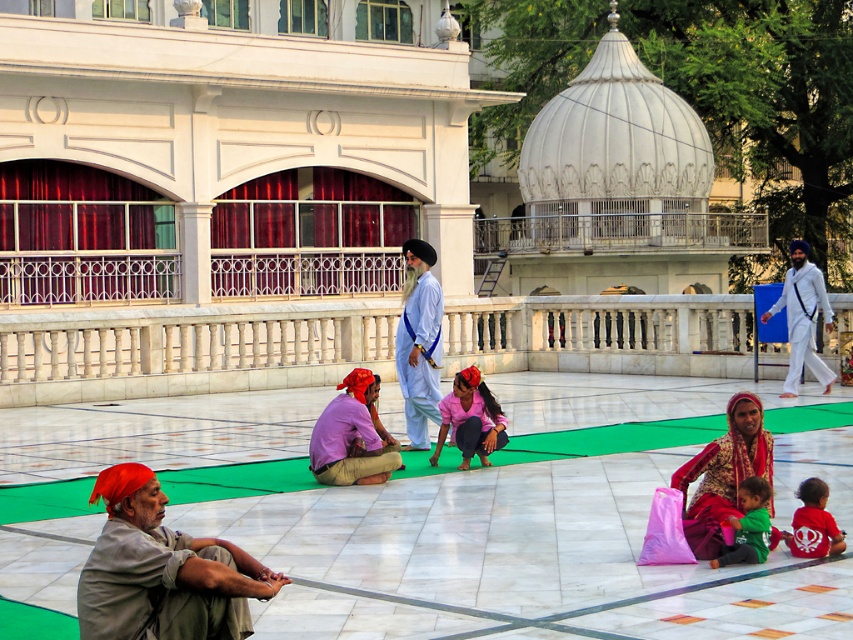
Which is above, light blue cotton kurta at center or pink cotton shirt at center?

light blue cotton kurta at center

How much distance is there between light blue cotton kurta at center and pink cotton shirt at center?

light blue cotton kurta at center is 6.64 feet from pink cotton shirt at center.

Which is behind, point (425, 365) or point (312, 456)?

Positioned behind is point (425, 365).

Identify the location of light blue cotton kurta at center. The width and height of the screenshot is (853, 640). (419, 342).

Is embroidered silk sari at lower right wider than white cotton turban at right?

In fact, embroidered silk sari at lower right might be narrower than white cotton turban at right.

Which of these two, embroidered silk sari at lower right or white cotton turban at right, stands shorter?

With less height is embroidered silk sari at lower right.

This screenshot has width=853, height=640. What do you see at coordinates (723, 474) in the screenshot?
I see `embroidered silk sari at lower right` at bounding box center [723, 474].

Where is `embroidered silk sari at lower right`? embroidered silk sari at lower right is located at coordinates (723, 474).

Is gray fabric turban at lower left below pink cotton shirt at center?

Correct, gray fabric turban at lower left is located below pink cotton shirt at center.

Is gray fabric turban at lower left positioned in front of pink cotton shirt at center?

That is True.

Which is in front, point (83, 609) or point (329, 451)?

Point (83, 609) is more forward.

Where is `gray fabric turban at lower left`? This screenshot has height=640, width=853. gray fabric turban at lower left is located at coordinates (161, 570).